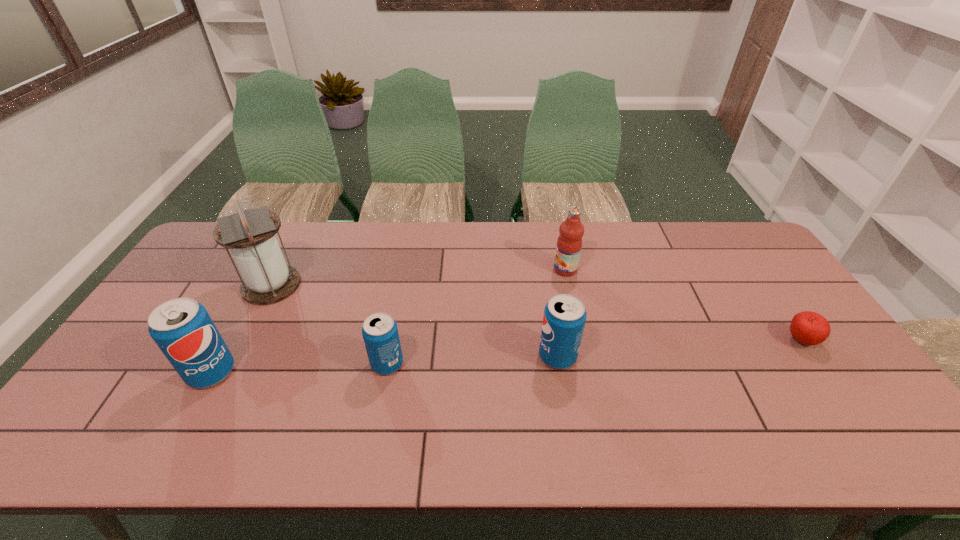
The image size is (960, 540). Identify the location of the leftmost soda can. (182, 328).

Find the location of a particular element. This screenshot has width=960, height=540. the second shortest object is located at coordinates (380, 333).

You are a GUI agent. You are given a task and a screenshot of the screen. Output one action in this format:
    pyautogui.click(x=<x>, y=<y>)
    Task: Click on the shortest soda can
    This screenshot has width=960, height=540.
    Given the screenshot: What is the action you would take?
    tap(380, 333)

Locate an element on the screen. the rightmost soda can is located at coordinates [564, 318].

Identify the location of the second tallest soda can. (564, 318).

Where is `the shortest object`? the shortest object is located at coordinates click(x=810, y=328).

What are the coordinates of `the rightmost object` in the screenshot? It's located at (810, 328).

Locate an element on the screen. Image resolution: width=960 pixels, height=540 pixels. fruit juice is located at coordinates (569, 243).

Locate an element on the screen. lantern is located at coordinates (267, 279).

The height and width of the screenshot is (540, 960). I want to click on blank area located 0.170m on the left of the leftmost soda can, so click(123, 372).